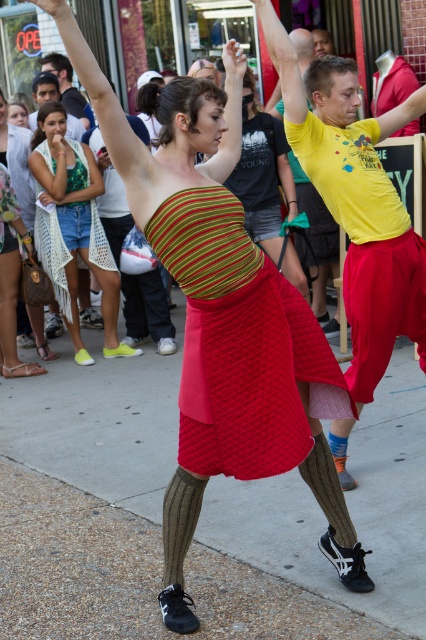
You are a photographer trying to capture the matte yellow tshirt at center in the image. The camera you are using has a rectangular viewfinder with a 16x9 aspect ratio. The point at coordinates (356, 202) is located at the center of the matte yellow tshirt at center. The viewfinder can only capture an area that is 0.4 units wide and 0.2 units tall. Will the entire matte yellow tshirt at center fit within the viewfinder?

The point at coordinates (356, 202) is located at the center of the matte yellow tshirt at center. The viewfinder can capture an area 0.4 units wide and 0.2 units tall. Since the viewfinder is centered on the tshirt and its dimensions are sufficient to encompass the tshirt, the entire matte yellow tshirt at center will fit within the viewfinder.

You are standing in the street scene and want to know which of the two points, point (37, 136) or point (48, 67), is closer to you. Can you determine this based on the scene?

Point (37, 136) is closer to the viewer than point (48, 67).

You are a photographer trying to capture the dancer in the knitted green and yellow top at center and the person in the matte black shirt at upper left. Which of the two subjects will appear larger in your photo?

The knitted green and yellow top at center will appear larger in the photo because it is much taller than the matte black shirt at upper left.